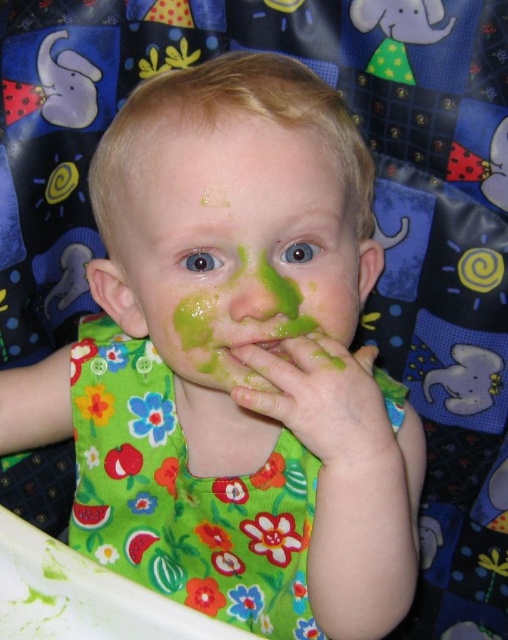
You are a photographer taking a picture of the child. You need to focus on the green matte face at center and the green fabric bib at center. Which one should you focus on first to ensure both are in focus?

You should focus on the green matte face at center first because it is closer to the viewer than the green fabric bib at center, so adjusting focus from the face to the bib will help both be in focus.